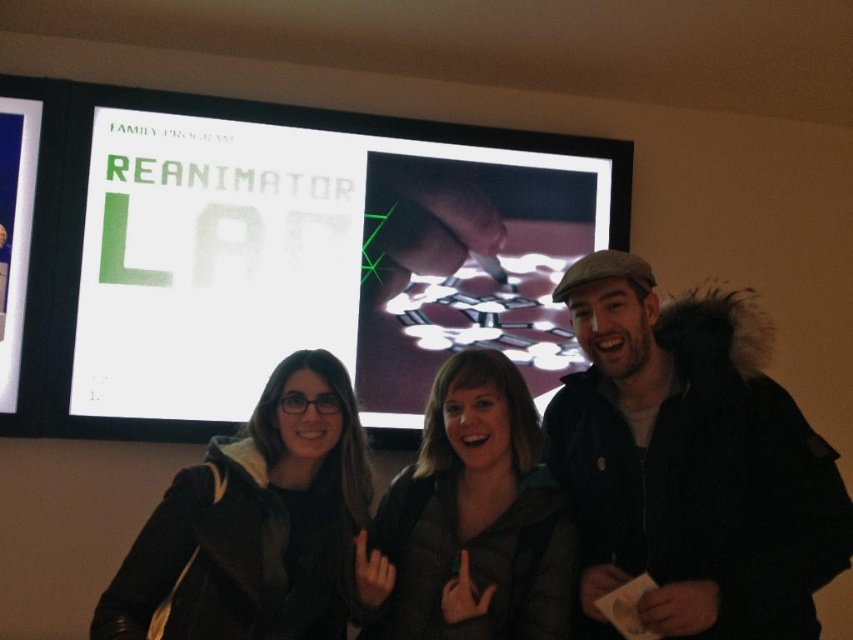
You are an interior designer planning to install a new lighting fixture in the room. The lighting fixture requires a minimum of 1.2 meters of clearance between the object and the ceiling. Given the white glossy projection screen at upper center and the black matte jacket at center, which object should you consider in your calculations?

The white glossy projection screen at upper center is located at the upper center, closer to the ceiling, so you should consider its height when calculating the clearance for the lighting fixture.